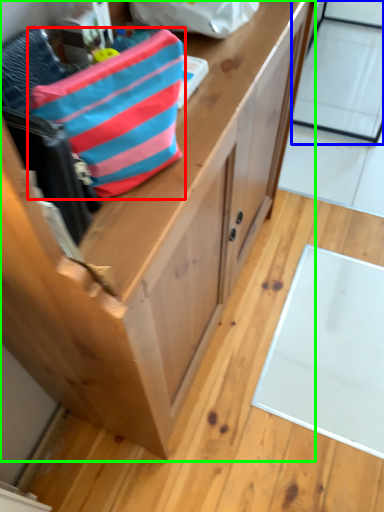
Question: Considering the real-world distances, which object is farthest from pouch (highlighted by a red box)? glass door (highlighted by a blue box) or cabinetry (highlighted by a green box)?

Choices:
 (A) glass door
 (B) cabinetry

Answer: (A)